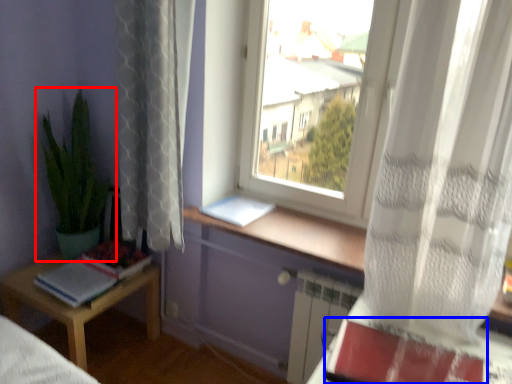
Question: Which object is closer to the camera taking this photo, houseplant (highlighted by a red box) or paperback book (highlighted by a blue box)?

Choices:
 (A) houseplant
 (B) paperback book

Answer: (B)